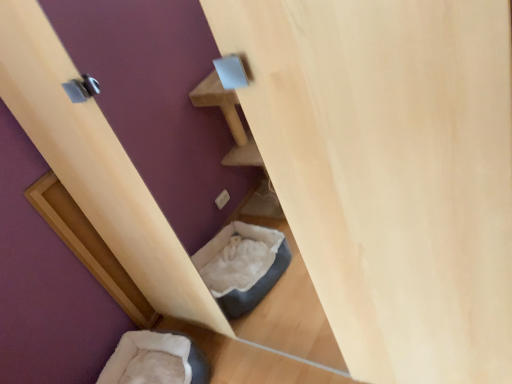
Describe the element at coordinates (156, 360) in the screenshot. I see `soft white fur bean bag at lower left` at that location.

I want to click on soft white fur bean bag at lower left, so click(x=156, y=360).

What is the approximate width of soft white fur bean bag at lower left?

It is 48.00 centimeters.

Describe the element at coordinates (89, 247) in the screenshot. I see `wooden door at lower left` at that location.

The height and width of the screenshot is (384, 512). Identify the location of wooden door at lower left. (89, 247).

At what (x,y) coordinates should I click in order to perform the action: click on soft white fur bean bag at lower left. Please return your answer as a coordinate pair (x, y). The image size is (512, 384). Looking at the image, I should click on (156, 360).

Which is more to the right, wooden door at lower left or soft white fur bean bag at lower left?

Positioned to the right is soft white fur bean bag at lower left.

Considering the relative positions of wooden door at lower left and soft white fur bean bag at lower left in the image provided, is wooden door at lower left behind soft white fur bean bag at lower left?

Yes, wooden door at lower left is further from the camera.

Is point (120, 286) less distant than point (155, 380)?

No, (120, 286) is further to viewer.

From the image's perspective, is wooden door at lower left located above or below soft white fur bean bag at lower left?

wooden door at lower left is situated higher than soft white fur bean bag at lower left in the image.

From a real-world perspective, is wooden door at lower left positioned under soft white fur bean bag at lower left based on gravity?

No, from a real-world perspective, wooden door at lower left is not beneath soft white fur bean bag at lower left.

Can you confirm if wooden door at lower left is wider than soft white fur bean bag at lower left?

Incorrect, the width of wooden door at lower left does not surpass that of soft white fur bean bag at lower left.

Who is taller, wooden door at lower left or soft white fur bean bag at lower left?

wooden door at lower left.

Based on their sizes in the image, would you say wooden door at lower left is bigger or smaller than soft white fur bean bag at lower left?

Clearly, wooden door at lower left is smaller in size than soft white fur bean bag at lower left.

Is soft white fur bean bag at lower left surrounded by wooden door at lower left?

No, soft white fur bean bag at lower left is located outside of wooden door at lower left.

Are wooden door at lower left and soft white fur bean bag at lower left located far from each other?

No, wooden door at lower left is not far from soft white fur bean bag at lower left.

Is wooden door at lower left aimed at soft white fur bean bag at lower left?

No, wooden door at lower left is not oriented towards soft white fur bean bag at lower left.

Where is `bean bag chair that is on the right side of wooden door at lower left`? This screenshot has width=512, height=384. bean bag chair that is on the right side of wooden door at lower left is located at coordinates (156, 360).

Is soft white fur bean bag at lower left at the right side of wooden door at lower left?

Yes.

Is the position of soft white fur bean bag at lower left more distant than that of wooden door at lower left?

No, soft white fur bean bag at lower left is in front of wooden door at lower left.

Is point (181, 368) closer to viewer compared to point (60, 232)?

No, (181, 368) is behind (60, 232).

From the image's perspective, which one is positioned higher, soft white fur bean bag at lower left or wooden door at lower left?

wooden door at lower left.

From a real-world perspective, which object stands above the other?

From a 3D spatial view, wooden door at lower left is above.

Is soft white fur bean bag at lower left wider or thinner than wooden door at lower left?

In the image, soft white fur bean bag at lower left appears to be wider than wooden door at lower left.

Which of these two, soft white fur bean bag at lower left or wooden door at lower left, stands taller?

wooden door at lower left.

Considering the relative sizes of soft white fur bean bag at lower left and wooden door at lower left in the image provided, is soft white fur bean bag at lower left smaller than wooden door at lower left?

No.

Can we say soft white fur bean bag at lower left lies outside wooden door at lower left?

Yes, soft white fur bean bag at lower left is located beyond the bounds of wooden door at lower left.

Is soft white fur bean bag at lower left directly adjacent to wooden door at lower left?

There is a gap between soft white fur bean bag at lower left and wooden door at lower left.

Could you tell me if soft white fur bean bag at lower left is turned towards wooden door at lower left?

No, soft white fur bean bag at lower left is not oriented towards wooden door at lower left.

Can you tell me how much soft white fur bean bag at lower left and wooden door at lower left differ in facing direction?

They differ by 13.6 degrees in their facing directions.

Identify the location of wood on the left of soft white fur bean bag at lower left. (89, 247).

This screenshot has height=384, width=512. Identify the location of bean bag chair in front of the wooden door at lower left. (156, 360).

Identify the location of bean bag chair located below the wooden door at lower left (from the image's perspective). (156, 360).